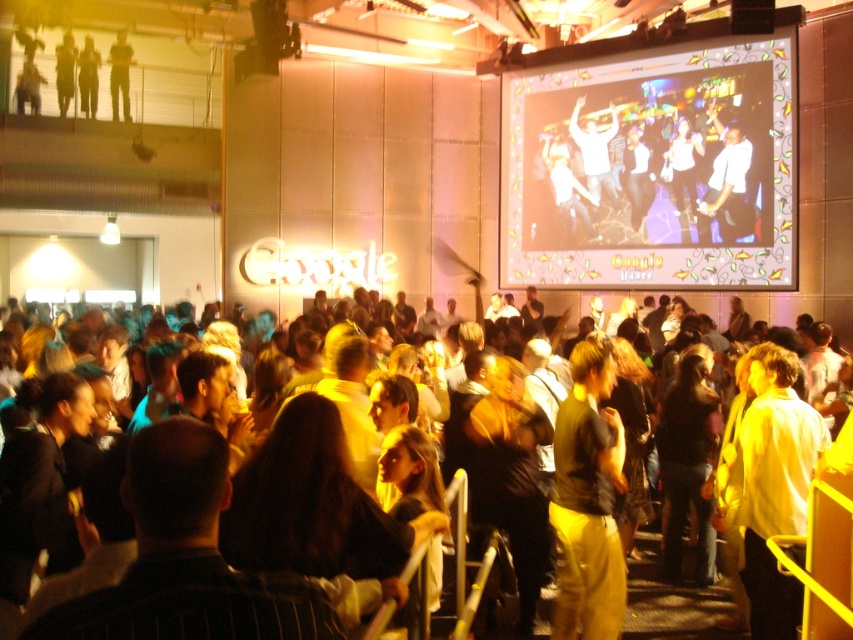
You are organizing a small presentation and need to decide if the matte plastic projection screen at upper right can accommodate a standard 16x9 aspect ratio slide. Considering the white matte shirt at right is 0.5 meters wide, can the screen display the slide without cropping?

The matte plastic projection screen at upper right might be wider than the white matte shirt at right, which is 0.5 meters wide. If the screen is indeed wider, it can accommodate a standard 16x9 slide without cropping, but if it is narrower, cropping may occur. Check the screen dimensions before deciding.

You are at a party and want to find a person wearing both a white matte shirt at upper right and dark gray pants at upper left. Based on the scene description, where would you look first to find this person?

The white matte shirt at upper right is below the dark gray pants at upper left, so you should look below the dark gray pants at upper left to find the person wearing both.